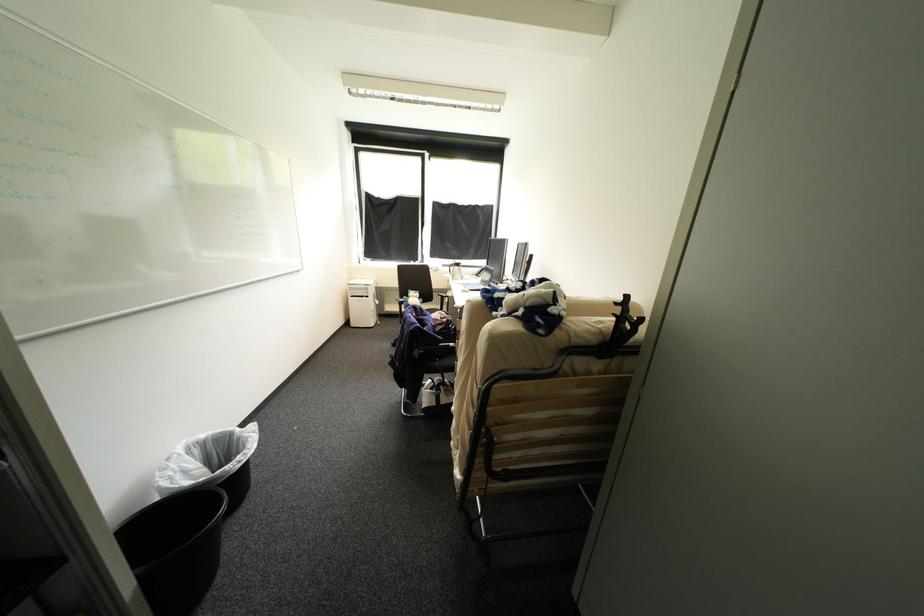
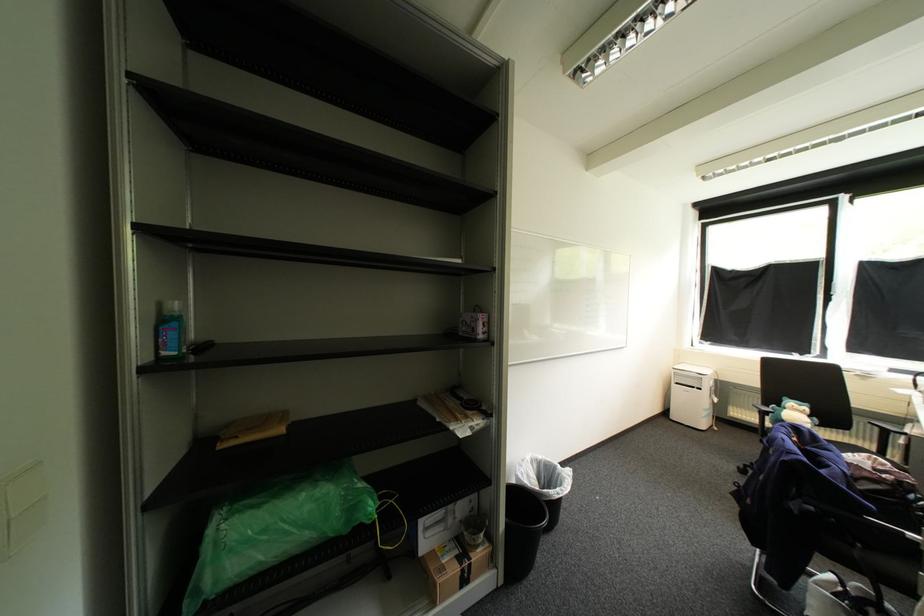
The point at (177, 474) is marked in the first image. Where is the corresponding point in the second image?

(529, 472)